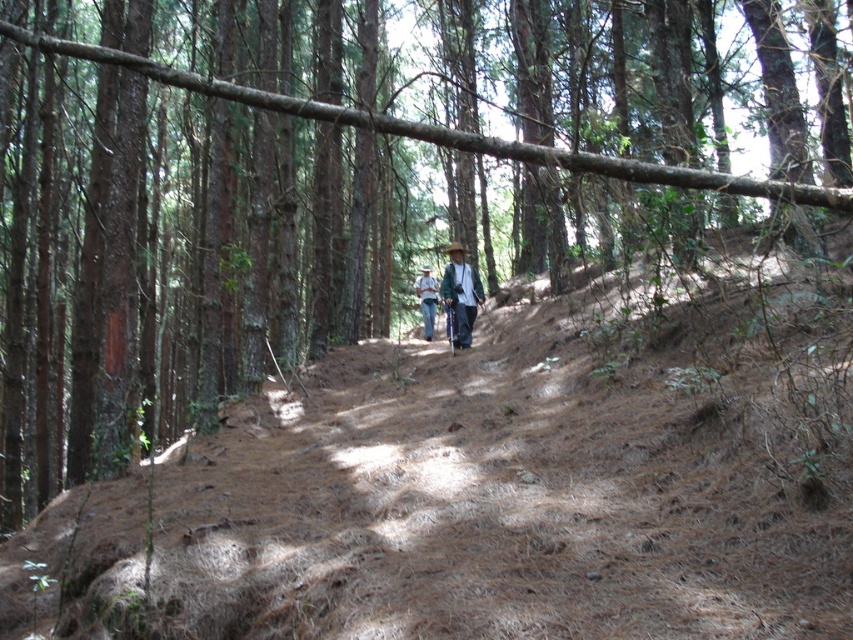
Based on the photo, you are a hiker walking along the forest path and see both the wooden walking stick at center and the camouflage fabric shirt at center. Which object is closer to you?

The wooden walking stick at center is closer to you because it is in front of the camouflage fabric shirt at center.

You are a hiker trying to pick up your wooden walking stick at center while your camouflage fabric shirt at center is on the ground. Can you reach it without moving your feet?

The wooden walking stick at center and camouflage fabric shirt at center are 15.86 feet apart. Since this distance is greater than an average person can reach, you cannot reach the camouflage fabric shirt at center without moving your feet.

You are a hiker who just found a wooden walking stick at center and a camouflage fabric shirt at center on the forest path. Which item is positioned to the right of the other?

The wooden walking stick at center is to the right of the camouflage fabric shirt at center.